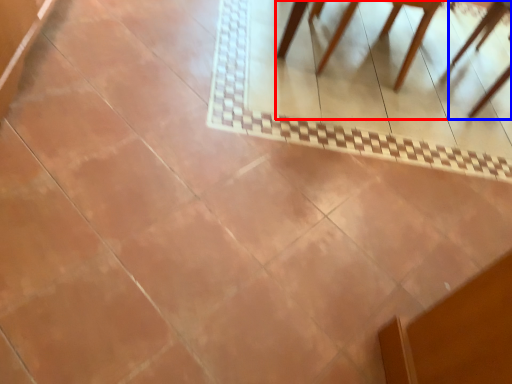
Question: Which object appears closest to the camera in this image, furniture (highlighted by a red box) or chair (highlighted by a blue box)?

Choices:
 (A) furniture
 (B) chair

Answer: (A)